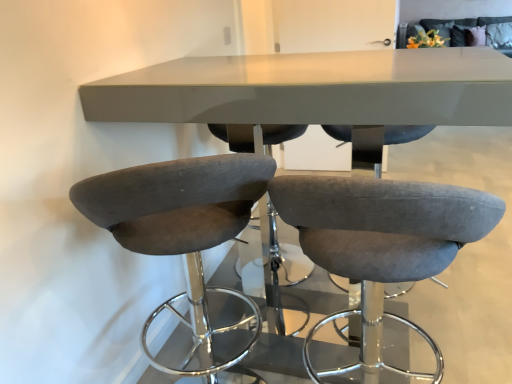
Question: Considering the positions of matte gray table at center and suede-like gray bar stool at left, which is the second chair from right to left, in the image, is matte gray table at center taller or shorter than suede-like gray bar stool at left, which is the second chair from right to left,?

Choices:
 (A) tall
 (B) short

Answer: (A)

Question: In terms of size, does matte gray table at center appear bigger or smaller than suede-like gray bar stool at left, which is the second chair from right to left?

Choices:
 (A) big
 (B) small

Answer: (A)

Question: Estimate the real-world distances between objects in this image. Which object is closer to the matte gray table at center?

Choices:
 (A) suede-like gray bar stool at left, which appears as the first chair when viewed from the left
 (B) suede gray bar stool at center, the 1th chair viewed from the right

Answer: (A)

Question: Which of these objects is positioned farthest from the suede gray bar stool at center, the 2th chair from the left?

Choices:
 (A) suede-like gray bar stool at left, which is the second chair from right to left
 (B) matte gray table at center

Answer: (B)